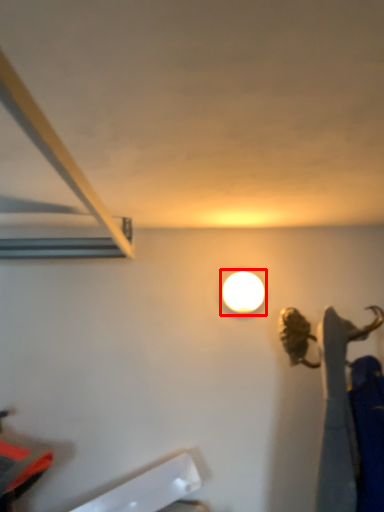
Question: Where is lamp (annotated by the red box) located in relation to wide in the image?

Choices:
 (A) right
 (B) left

Answer: (A)